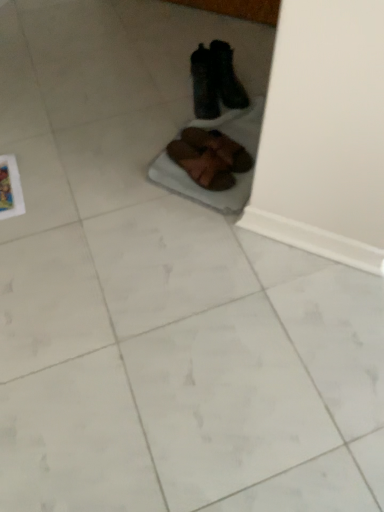
Question: Is black fuzzy slippers at center, positioned as the 2th footwear in top-to-bottom order, inside or outside of brown suede shoes at center, which ranks as the third footwear in top-to-bottom order?

Choices:
 (A) inside
 (B) outside

Answer: (B)

Question: Relative to brown suede shoes at center, marked as the second footwear in a bottom-to-top arrangement, is black fuzzy slippers at center, positioned as the 2th footwear in top-to-bottom order, in front or behind?

Choices:
 (A) behind
 (B) front

Answer: (A)

Question: Which object is positioned closest to the black leather boots at upper center, positioned as the first footwear in top-to-bottom order?

Choices:
 (A) brown suede shoes at center, placed as the 4th footwear when sorted from top to bottom
 (B) brown suede shoes at center, which ranks as the third footwear in top-to-bottom order
 (C) black fuzzy slippers at center, positioned as the 2th footwear in top-to-bottom order

Answer: (C)

Question: Which object is positioned closest to the black leather boots at upper center, positioned as the first footwear in top-to-bottom order?

Choices:
 (A) brown suede shoes at center, the first footwear from the bottom
 (B) black fuzzy slippers at center, positioned as the 2th footwear in top-to-bottom order
 (C) brown suede shoes at center, marked as the second footwear in a bottom-to-top arrangement

Answer: (B)